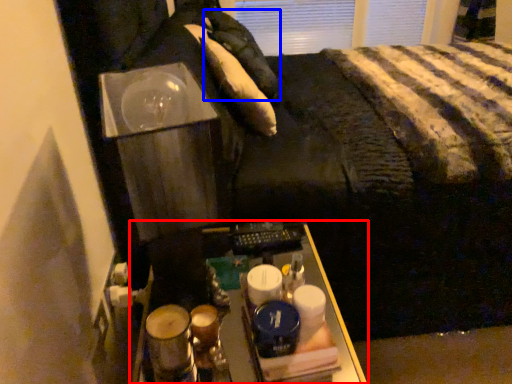
Question: Which object is closer to the camera taking this photo, furniture (highlighted by a red box) or pillow (highlighted by a blue box)?

Choices:
 (A) furniture
 (B) pillow

Answer: (A)